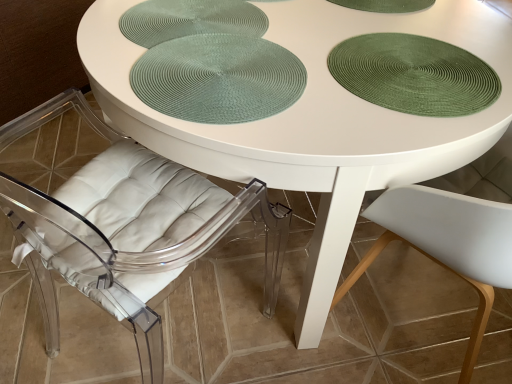
Find the location of a particular element. The height and width of the screenshot is (384, 512). vacant space that is in between green woven placemat at upper center, which ranks as the first glass plate in left-to-right order, and green textured placemat at upper right, positioned as the 2th glass plate in left-to-right order is located at coordinates (291, 53).